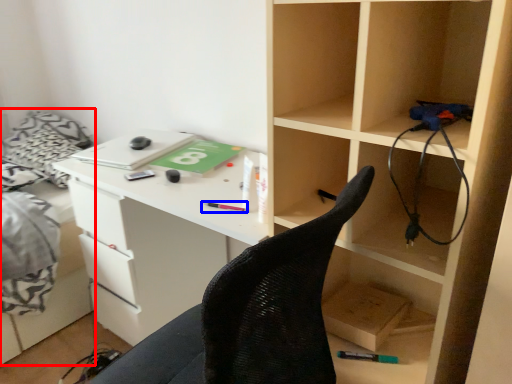
Question: Which object is further to the camera taking this photo, bed (highlighted by a red box) or stationery (highlighted by a blue box)?

Choices:
 (A) bed
 (B) stationery

Answer: (A)